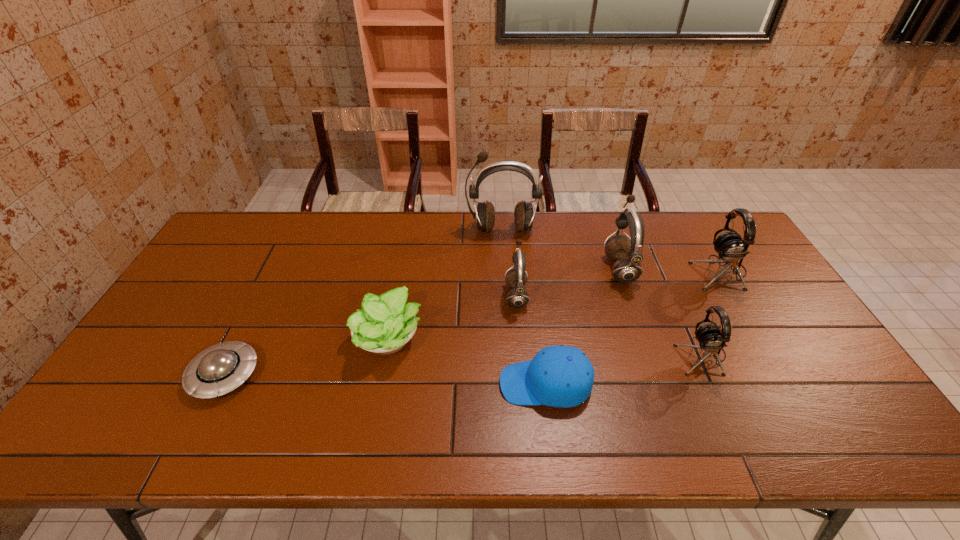
Where is `vacant position at the near edge of the desktop`? This screenshot has height=540, width=960. vacant position at the near edge of the desktop is located at coordinates (474, 430).

In the image, there is a desktop. What are the coordinates of `vacant space at the left edge` in the screenshot? It's located at (218, 270).

The image size is (960, 540). In order to click on vacant space at the right edge of the desktop in this screenshot , I will do `click(831, 386)`.

This screenshot has height=540, width=960. What are the coordinates of `vacant area at the near right corner` in the screenshot? It's located at (856, 428).

Find the location of a particular element. free space between the farther black earphone and the rightmost brown earphone is located at coordinates (670, 270).

Locate an element on the screen. Image resolution: width=960 pixels, height=540 pixels. vacant area that lies between the bigger black earphone and the shortest object is located at coordinates (472, 323).

At what (x,y) coordinates should I click in order to perform the action: click on free space between the seventh object from right to left and the blue cap. Please return your answer as a coordinate pair (x, y). Looking at the image, I should click on (468, 361).

In order to click on vacant area that lies between the shortest object and the rightmost earphone in this screenshot , I will do `click(472, 323)`.

This screenshot has height=540, width=960. Identify the location of vacant area that lies between the smallest brown earphone and the lettuce. (453, 316).

Locate an element on the screen. This screenshot has height=540, width=960. vacant space that's between the shortest object and the nearer black earphone is located at coordinates (463, 365).